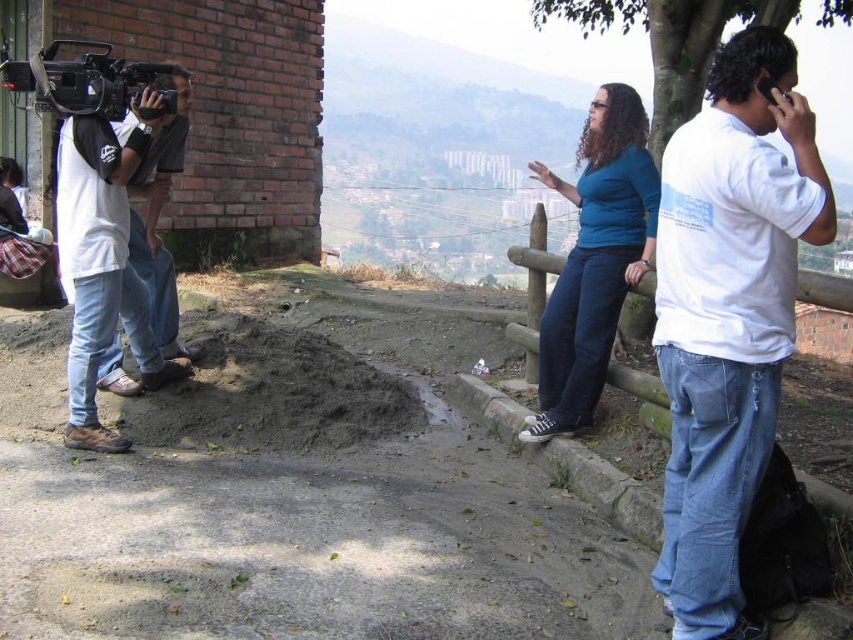
You are a photographer positioned at the center of the image. You need to capture a photo that includes both the white cotton shirt at right and the two individuals on the left. Based on their positions, will you be able to frame both subjects in a single shot without moving your camera? Please explain using their coordinates.

The white cotton shirt at right is located at point (728, 316), while the two individuals on the left are positioned further away in the opposite direction. Since these coordinates are on opposite sides of the center, it is likely possible to frame both in a single shot if the camera has a wide enough lens to cover the horizontal distance between them.

From the picture: You are a photographer trying to capture a wide shot of the scene. You have a black plastic video camera at upper left and a black plastic phone at upper right. Which device should you use if you want to include both the camera and the phone in the frame without moving your position?

You should use the black plastic phone at upper right because the black plastic video camera at upper left is to the left of it, so using the phone might allow you to frame both devices by adjusting the angle or zoom.